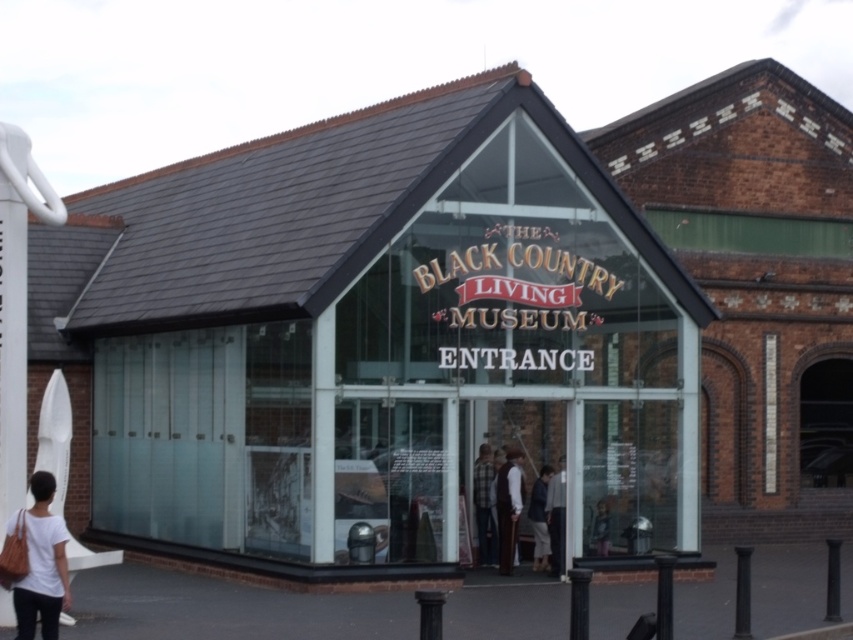
Measure the distance from black asphalt pavement at lower center to white matte shirt at lower left.

black asphalt pavement at lower center and white matte shirt at lower left are 21.44 feet apart.

Who is more distant from viewer, (807, 580) or (41, 595)?

The point (807, 580) is more distant.

In order to click on black asphalt pavement at lower center in this screenshot , I will do `click(227, 609)`.

Does transparent glass building at center appear on the left side of dark brown leather jacket at center?

Indeed, transparent glass building at center is positioned on the left side of dark brown leather jacket at center.

Does transparent glass building at center have a greater height compared to dark brown leather jacket at center?

Correct, transparent glass building at center is much taller as dark brown leather jacket at center.

Does point (201, 467) come closer to viewer compared to point (543, 538)?

That is True.

The width and height of the screenshot is (853, 640). Identify the location of transparent glass building at center. (370, 340).

Which is more to the right, transparent glass building at center or black asphalt pavement at lower center?

black asphalt pavement at lower center

Between point (518, 83) and point (703, 634), which one is positioned in front?

Point (703, 634) is more forward.

Identify the location of transparent glass building at center. (370, 340).